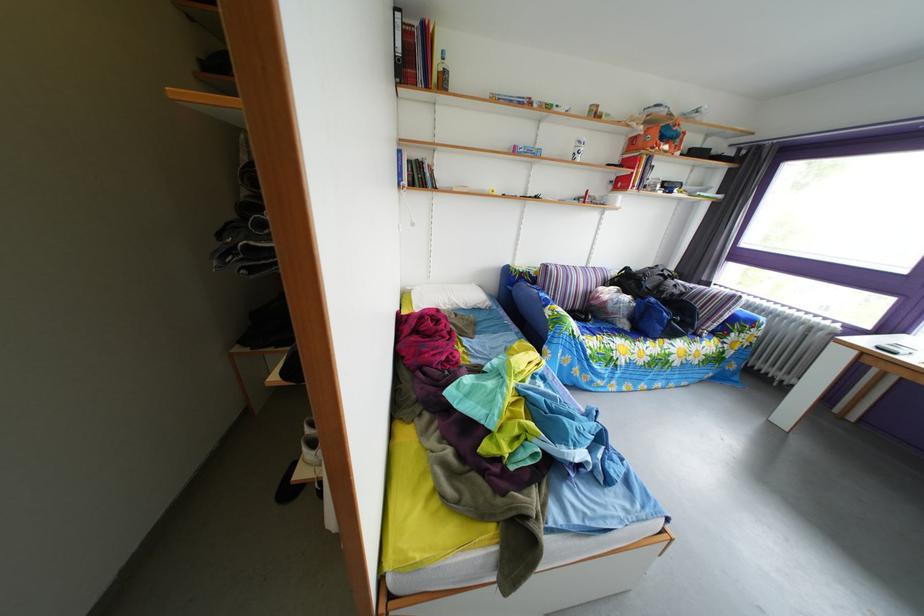
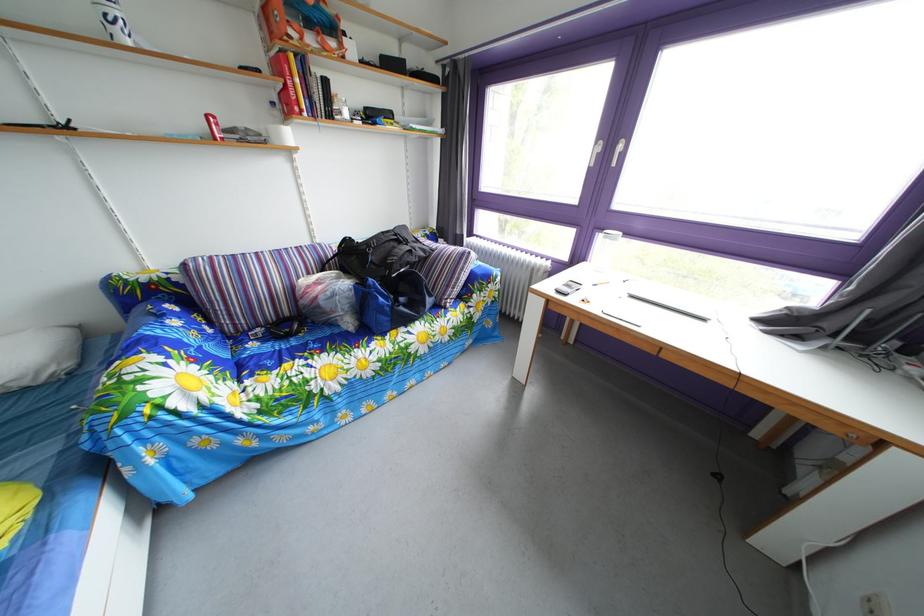
In the second image, find the point that corresponds to pixel 686 294 in the first image.

(421, 260)